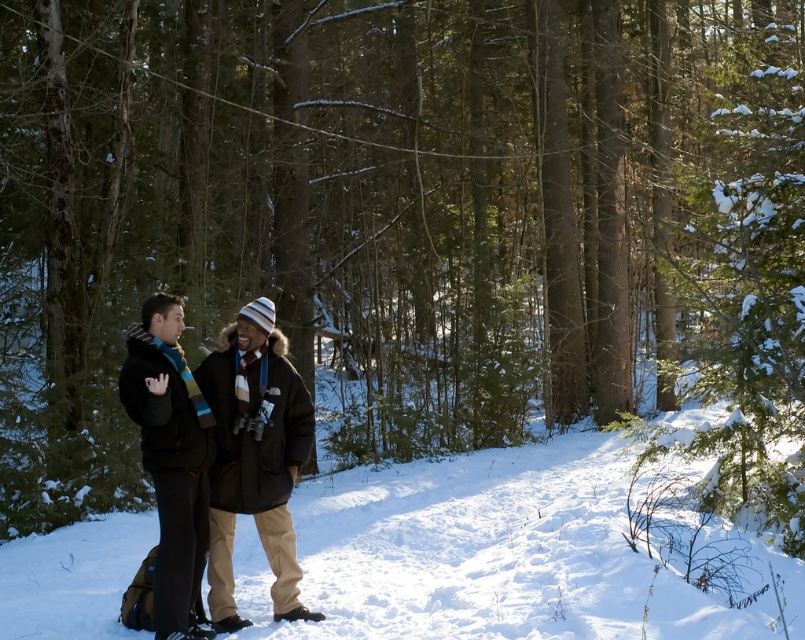
You are a photographer trying to capture a closeup of the dark brown wool coat at center and the knitted wool scarf at left. Since your camera can only focus on one object at a time, which object should you focus on first to ensure it is in focus when taking the photo?

The dark brown wool coat at center is wider than the knitted wool scarf at left, so you should focus on the dark brown wool coat at center first to ensure it is in focus.

You are standing at the origin point in the winter forest scene. A dark brown wool coat at center is located at coordinates point [226,436]. If you want to move towards the dark brown wool coat at center, which direction should you move?

The point [226,436] marks the location of the dark brown wool coat at center. To move towards it from the origin, you should move in the direction of the coordinates [226,436].

You are planning to take a winter walk in the forest and want to ensure your clothing layers are properly arranged. Given the scene described, does the dark brown wool coat at center need to be adjusted so that it is above the knitted wool scarf at left?

The dark brown wool coat at center is located below the knitted wool scarf at left, so it is already positioned correctly as coats are typically worn over scarves. No adjustment is needed.